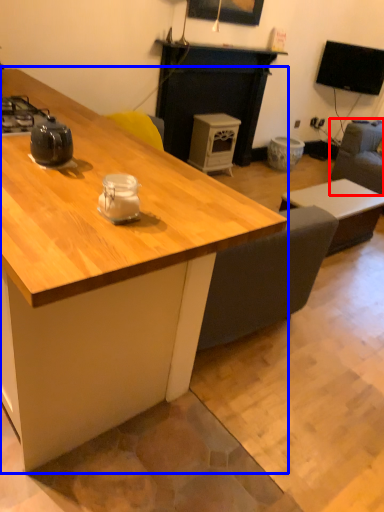
Question: Which of the following is the closest to the observer, swivel chair (highlighted by a red box) or desk (highlighted by a blue box)?

Choices:
 (A) swivel chair
 (B) desk

Answer: (B)